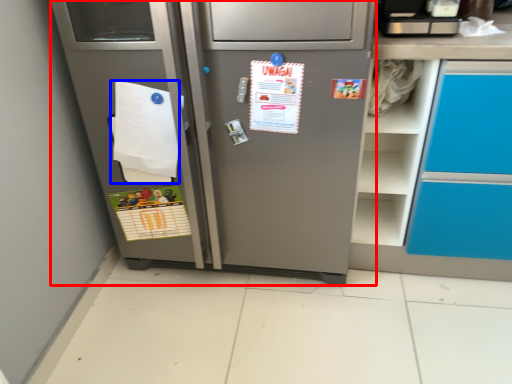
Question: Which of the following is the closest to the observer, refrigerator (highlighted by a red box) or paper (highlighted by a blue box)?

Choices:
 (A) refrigerator
 (B) paper

Answer: (A)